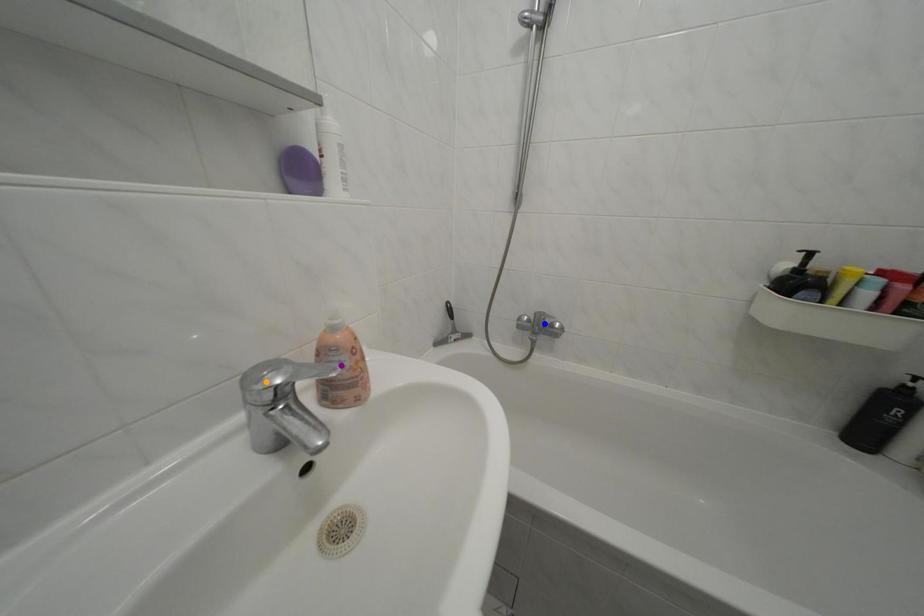
Order these from nearest to farthest:
blue point, orange point, purple point

1. orange point
2. purple point
3. blue point